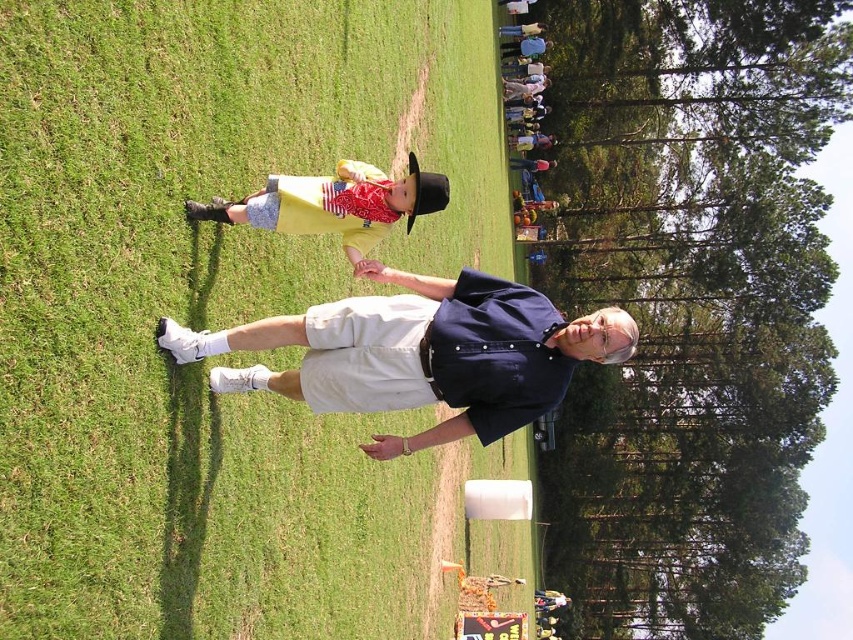
Question: Does dark blue shirt at center lie in front of matte yellow shirt at center?

Choices:
 (A) no
 (B) yes

Answer: (A)

Question: Considering the real-world distances, which object is farthest from the matte yellow shirt at center?

Choices:
 (A) dark blue shirt at center
 (B) green grass at center

Answer: (B)

Question: Does green grass at center come in front of dark blue shirt at center?

Choices:
 (A) no
 (B) yes

Answer: (B)

Question: Is dark blue shirt at center wider than matte yellow shirt at center?

Choices:
 (A) no
 (B) yes

Answer: (B)

Question: Which of the following is the closest to the observer?

Choices:
 (A) matte yellow shirt at center
 (B) dark blue shirt at center
 (C) green grass at center

Answer: (C)

Question: Which object is positioned farthest from the dark blue shirt at center?

Choices:
 (A) matte yellow shirt at center
 (B) green grass at center

Answer: (B)